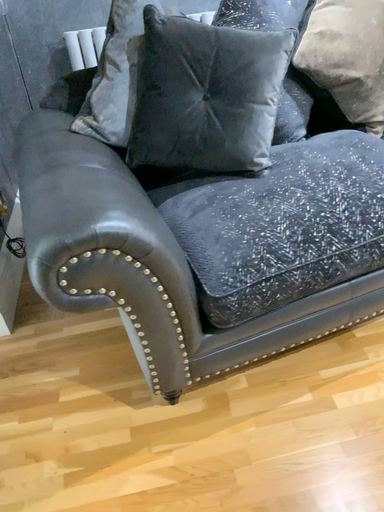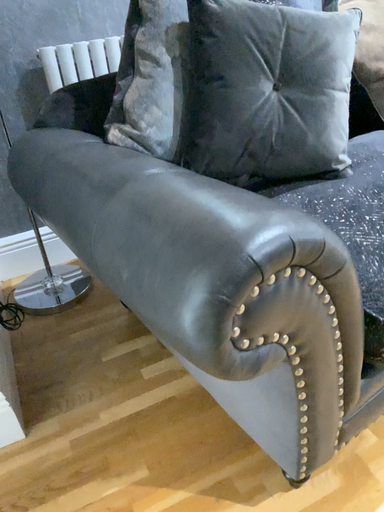
Question: How did the camera likely rotate when shooting the video?

Choices:
 (A) rotated downward
 (B) rotated upward

Answer: (B)